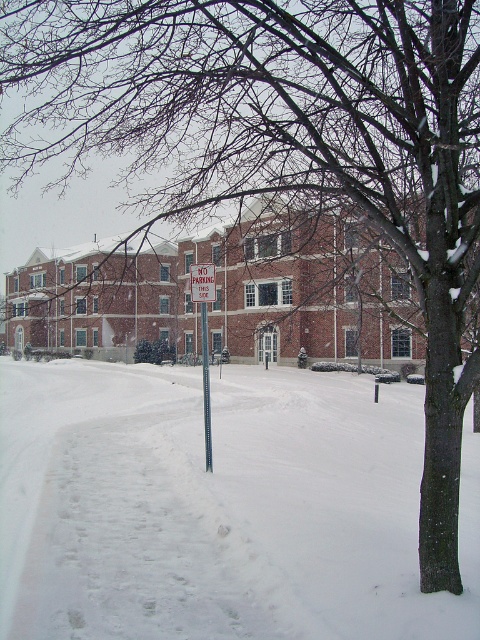
You are a delivery person trying to park your van near the NO PARKING sign. The van requires a parking space that is at least 3 meters wide. Given that the metallic pole at center and the red plastic sign at center are in the middle of the frame, can you park your van here?

The metallic pole at center has a smaller size compared to red plastic sign at center, but this does not provide information about the width of the parking space. Without knowing the distance between the pole and any obstacles, it is impossible to determine if the space is wide enough for the van.

You are standing at the center of the snowy scene. There is a metallic pole at center. What is located at the point with coordinates (205,387)?

The metallic pole at center is located at point (205,387).